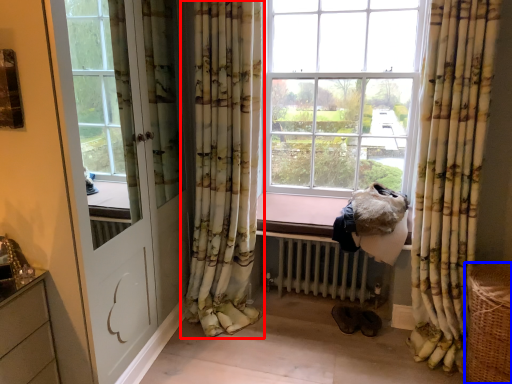
Question: Which object appears closest to the camera in this image, curtain (highlighted by a red box) or basket (highlighted by a blue box)?

Choices:
 (A) curtain
 (B) basket

Answer: (B)